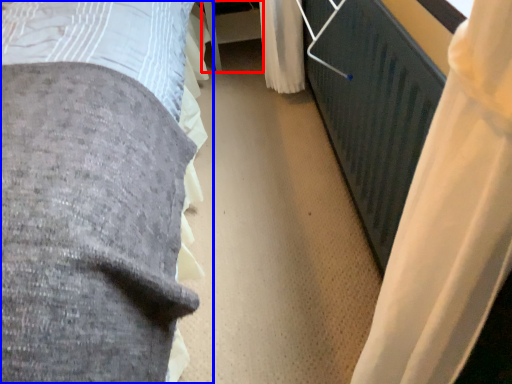
Question: Which object is closer to the camera taking this photo, table (highlighted by a red box) or bed (highlighted by a blue box)?

Choices:
 (A) table
 (B) bed

Answer: (B)